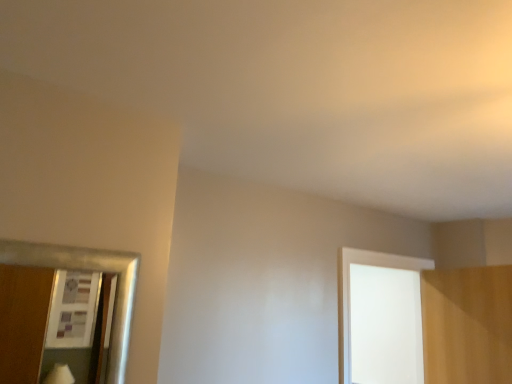
Question: Should I look upward or downward to see white matte window at upper right?

Choices:
 (A) up
 (B) down

Answer: (B)